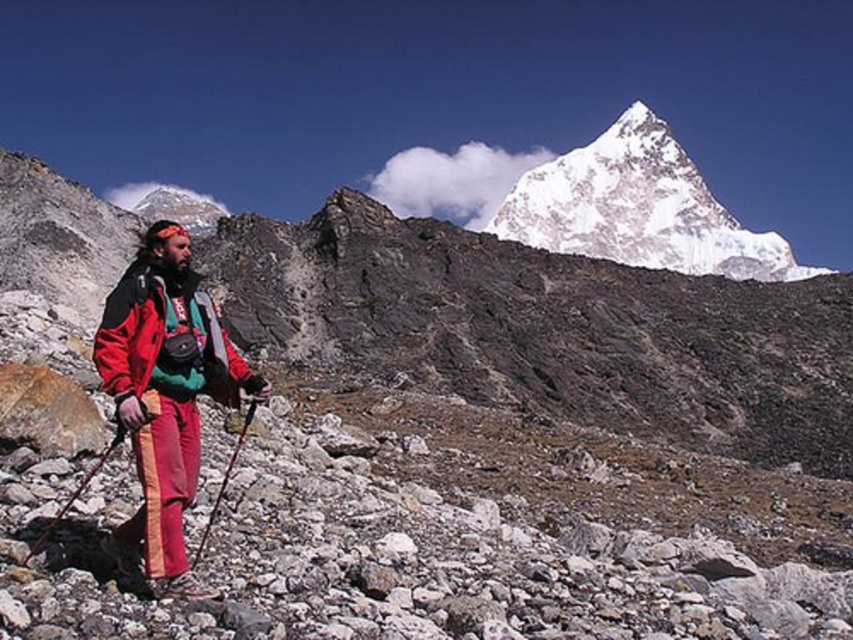
You are navigating a steep mountain slope and need to place two markers at the coordinates point (631,186) and point (228,396). Which marker will be closer to your current position?

Point (631,186) is closer to your current position because it is further to the viewer than point (228,396).

You are a photographer trying to capture both the matte red ski suit at left and the matte red jacket at center in the same frame. Which object should you zoom out to include both?

You should zoom out to include both the matte red ski suit at left and the matte red jacket at center because the matte red ski suit at left is bigger than the matte red jacket at center, requiring a wider angle to fit both in the frame.